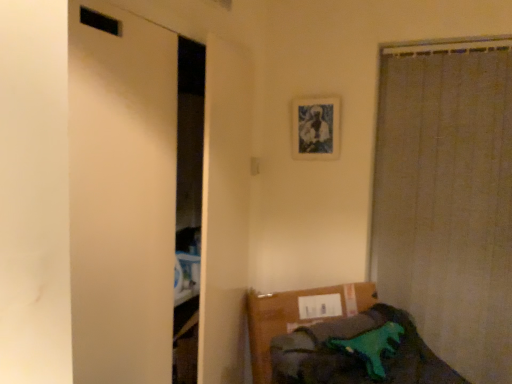
Question: Is beige textured curtain at right far away from green plastic toy dinosaur at lower right?

Choices:
 (A) no
 (B) yes

Answer: (A)

Question: Is beige textured curtain at right located outside green plastic toy dinosaur at lower right?

Choices:
 (A) no
 (B) yes

Answer: (B)

Question: Is beige textured curtain at right further to the viewer compared to green plastic toy dinosaur at lower right?

Choices:
 (A) yes
 (B) no

Answer: (A)

Question: Can you confirm if beige textured curtain at right is shorter than green plastic toy dinosaur at lower right?

Choices:
 (A) yes
 (B) no

Answer: (B)

Question: From a real-world perspective, does beige textured curtain at right stand above green plastic toy dinosaur at lower right?

Choices:
 (A) no
 (B) yes

Answer: (B)

Question: Is beige textured curtain at right at the right side of green plastic toy dinosaur at lower right?

Choices:
 (A) no
 (B) yes

Answer: (B)

Question: Is green plastic toy dinosaur at lower right located outside beige textured curtain at right?

Choices:
 (A) yes
 (B) no

Answer: (A)

Question: Is green plastic toy dinosaur at lower right next to beige textured curtain at right?

Choices:
 (A) no
 (B) yes

Answer: (A)

Question: Does green plastic toy dinosaur at lower right have a lesser width compared to beige textured curtain at right?

Choices:
 (A) no
 (B) yes

Answer: (A)

Question: Is green plastic toy dinosaur at lower right to the left of beige textured curtain at right from the viewer's perspective?

Choices:
 (A) no
 (B) yes

Answer: (B)

Question: Does green plastic toy dinosaur at lower right have a smaller size compared to beige textured curtain at right?

Choices:
 (A) yes
 (B) no

Answer: (B)

Question: Can you confirm if green plastic toy dinosaur at lower right is positioned to the right of beige textured curtain at right?

Choices:
 (A) yes
 (B) no

Answer: (B)

Question: From a real-world perspective, is beige textured curtain at right beneath blue textured fabric picture frame at upper center?

Choices:
 (A) yes
 (B) no

Answer: (A)